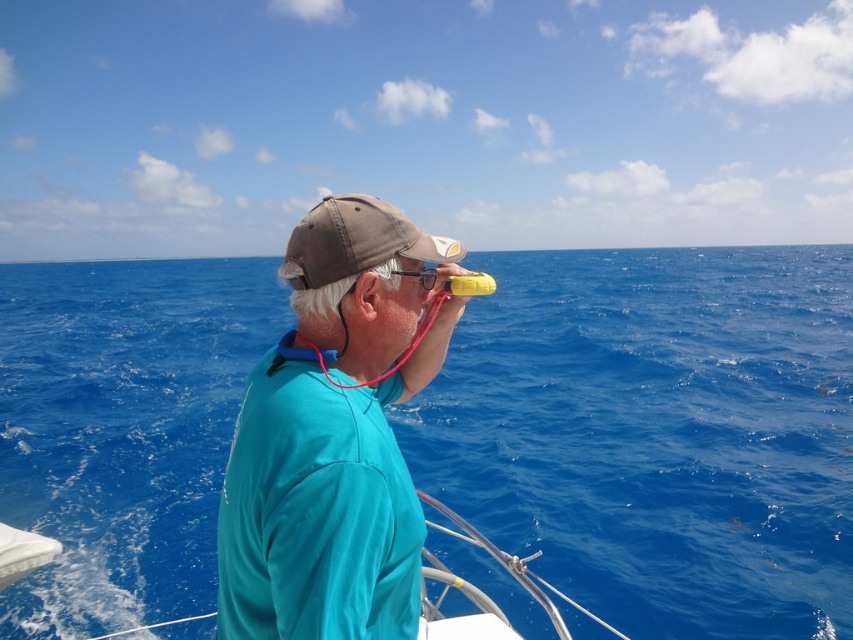
Is teal fabric shirt at center above brown cotton baseball cap at center?

Actually, teal fabric shirt at center is below brown cotton baseball cap at center.

Is teal fabric shirt at center closer to camera compared to brown cotton baseball cap at center?

Yes.

Who is more forward, (396, 573) or (350, 256)?

Point (396, 573) is in front.

The height and width of the screenshot is (640, 853). What are the coordinates of `teal fabric shirt at center` in the screenshot? It's located at (322, 502).

Who is lower down, blue water at center or teal fabric shirt at center?

teal fabric shirt at center is below.

Is blue water at center positioned in front of teal fabric shirt at center?

No, it is behind teal fabric shirt at center.

Who is more distant from viewer, (461, 438) or (251, 588)?

Point (461, 438)

This screenshot has width=853, height=640. What are the coordinates of `blue water at center` in the screenshot? It's located at (657, 433).

Is blue water at center thinner than brown cotton baseball cap at center?

No.

Image resolution: width=853 pixels, height=640 pixels. I want to click on blue water at center, so click(x=657, y=433).

Is point (811, 616) in front of point (308, 262)?

No.

The height and width of the screenshot is (640, 853). What are the coordinates of `blue water at center` in the screenshot? It's located at (657, 433).